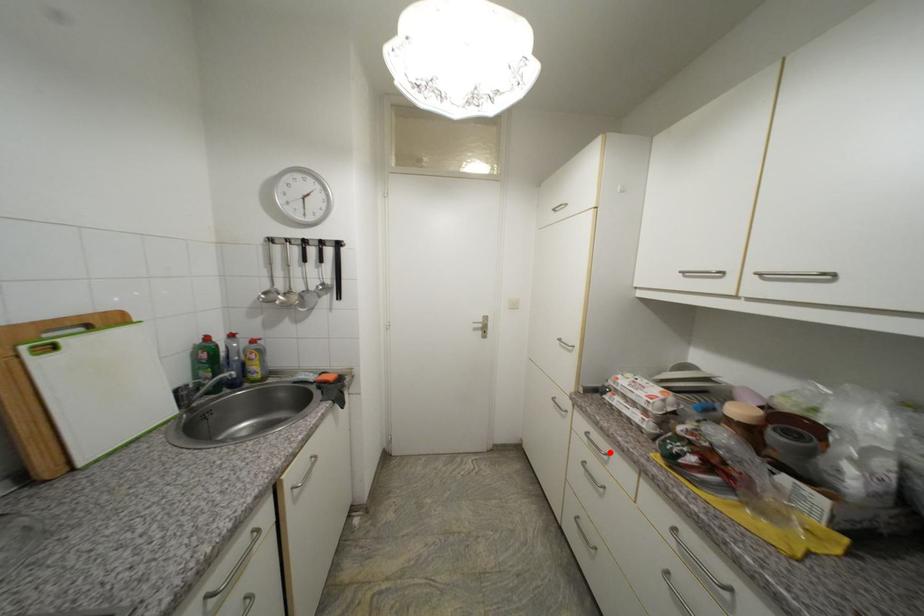
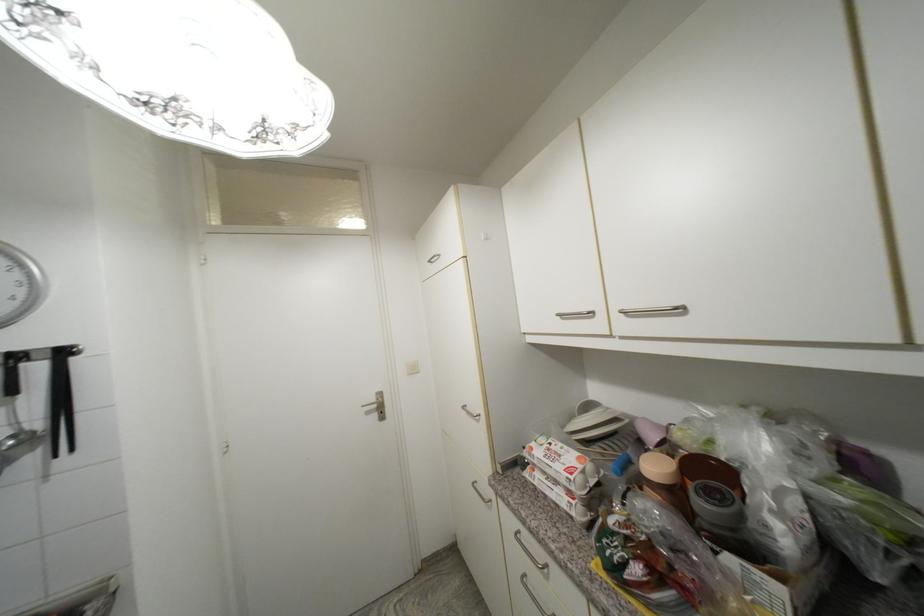
Question: I am providing you with two images of the same scene from different viewpoints. Given a red point in image1, look at the same physical point in image2. Is it:

Choices:
 (A) Closer to the viewpoint
 (B) Farther from the viewpoint

Answer: (B)